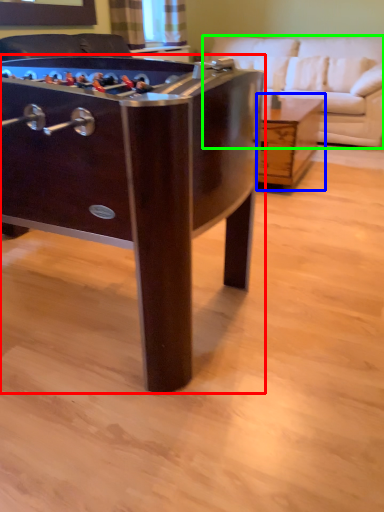
Question: Estimate the real-world distances between objects in this image. Which object is farther from table (highlighted by a red box), table (highlighted by a blue box) or studio couch (highlighted by a green box)?

Choices:
 (A) table
 (B) studio couch

Answer: (B)